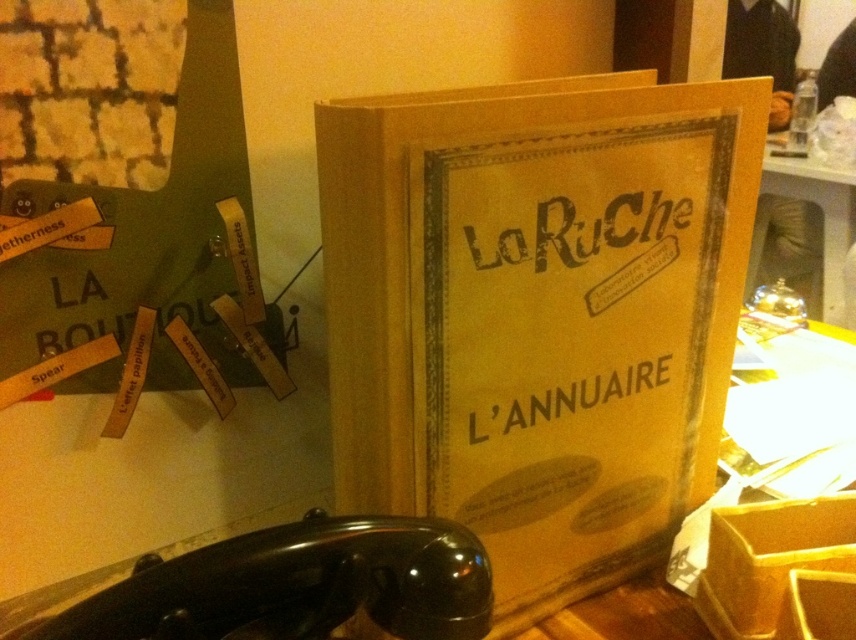
Question: Among these objects, which one is farthest from the camera?

Choices:
 (A) metallic silver bell at center
 (B) yellow cardboard book at center

Answer: (A)

Question: Is yellow cardboard book at center below metallic silver bell at center?

Choices:
 (A) no
 (B) yes

Answer: (B)

Question: Does yellow cardboard book at center have a smaller size compared to metallic silver bell at center?

Choices:
 (A) yes
 (B) no

Answer: (B)

Question: Is yellow cardboard book at center positioned in front of metallic silver bell at center?

Choices:
 (A) yes
 (B) no

Answer: (A)